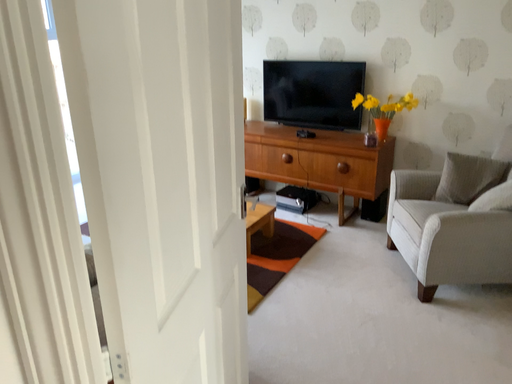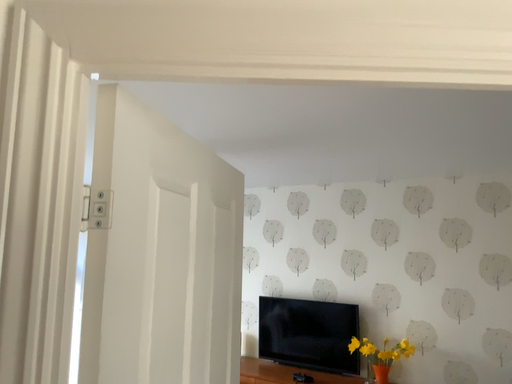
Question: How did the camera likely rotate when shooting the video?

Choices:
 (A) rotated upward
 (B) rotated downward

Answer: (A)